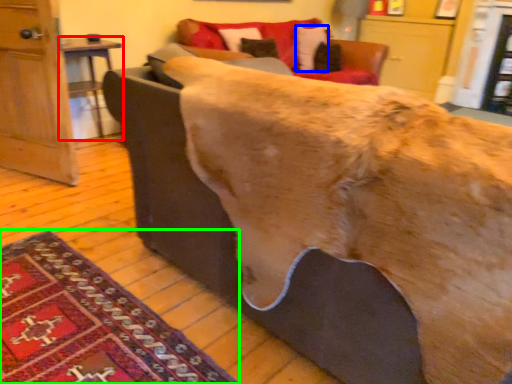
Question: Which is farther away from table (highlighted by a red box)? pillow (highlighted by a blue box) or mat (highlighted by a green box)?

Choices:
 (A) pillow
 (B) mat

Answer: (B)